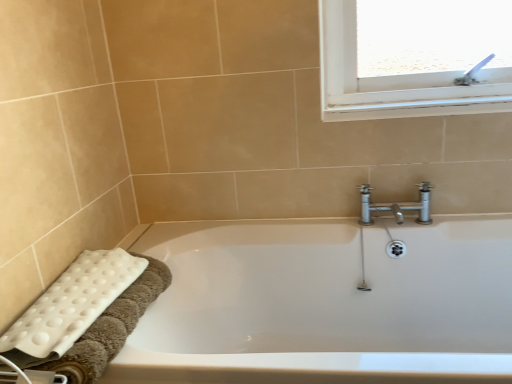
Question: Can you confirm if white plastic towel bar at lower left is thinner than white glossy bathtub at lower left?

Choices:
 (A) no
 (B) yes

Answer: (B)

Question: Is white plastic towel bar at lower left smaller than white glossy bathtub at lower left?

Choices:
 (A) yes
 (B) no

Answer: (A)

Question: Does white plastic towel bar at lower left appear on the left side of white glossy bathtub at lower left?

Choices:
 (A) no
 (B) yes

Answer: (B)

Question: Does white plastic towel bar at lower left have a lesser height compared to white glossy bathtub at lower left?

Choices:
 (A) yes
 (B) no

Answer: (A)

Question: From the image's perspective, does white plastic towel bar at lower left appear higher than white glossy bathtub at lower left?

Choices:
 (A) no
 (B) yes

Answer: (B)

Question: Is white glossy bathtub at lower left a part of white plastic towel bar at lower left?

Choices:
 (A) no
 (B) yes

Answer: (A)

Question: Can you confirm if white textured bath towel at lower left is positioned to the left of white glossy bathtub at lower left?

Choices:
 (A) no
 (B) yes

Answer: (B)

Question: Considering the relative positions of white textured bath towel at lower left and white glossy bathtub at lower left in the image provided, is white textured bath towel at lower left behind white glossy bathtub at lower left?

Choices:
 (A) no
 (B) yes

Answer: (B)

Question: Can you confirm if white textured bath towel at lower left is bigger than white glossy bathtub at lower left?

Choices:
 (A) yes
 (B) no

Answer: (B)

Question: Is white textured bath towel at lower left oriented towards white glossy bathtub at lower left?

Choices:
 (A) no
 (B) yes

Answer: (A)

Question: Does white textured bath towel at lower left have a lesser width compared to white glossy bathtub at lower left?

Choices:
 (A) yes
 (B) no

Answer: (A)

Question: Does white textured bath towel at lower left have a smaller size compared to white glossy bathtub at lower left?

Choices:
 (A) yes
 (B) no

Answer: (A)

Question: Is white plastic towel bar at lower left with white textured bath towel at lower left?

Choices:
 (A) yes
 (B) no

Answer: (B)